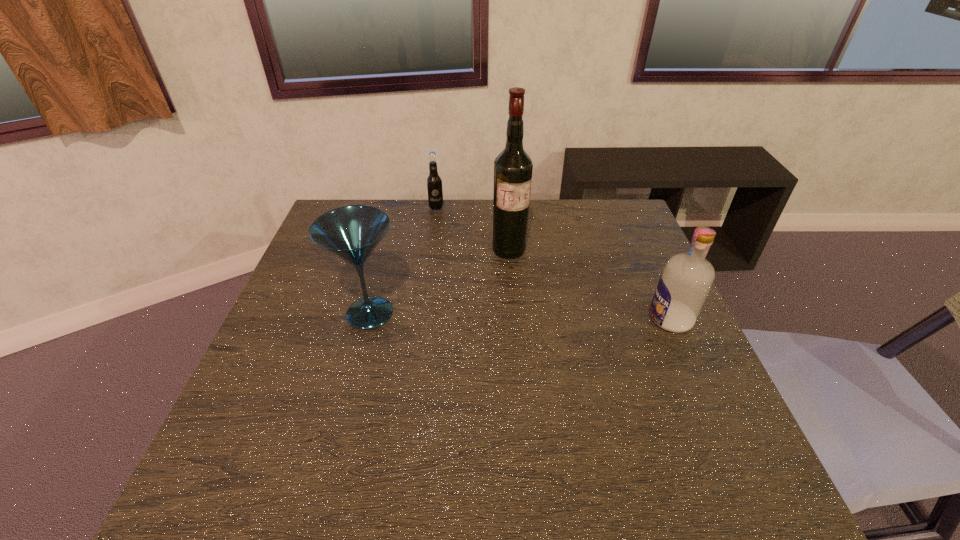
The height and width of the screenshot is (540, 960). Find the location of `free space on the desktop that is between the leftmost object and the rightmost object and is positioned on the front and back of the tallest object`. free space on the desktop that is between the leftmost object and the rightmost object and is positioned on the front and back of the tallest object is located at coordinates (538, 316).

What are the coordinates of `vacant space on the desktop that is between the leftmost object and the vodka and is positioned on the label of the root beer` in the screenshot? It's located at (480, 315).